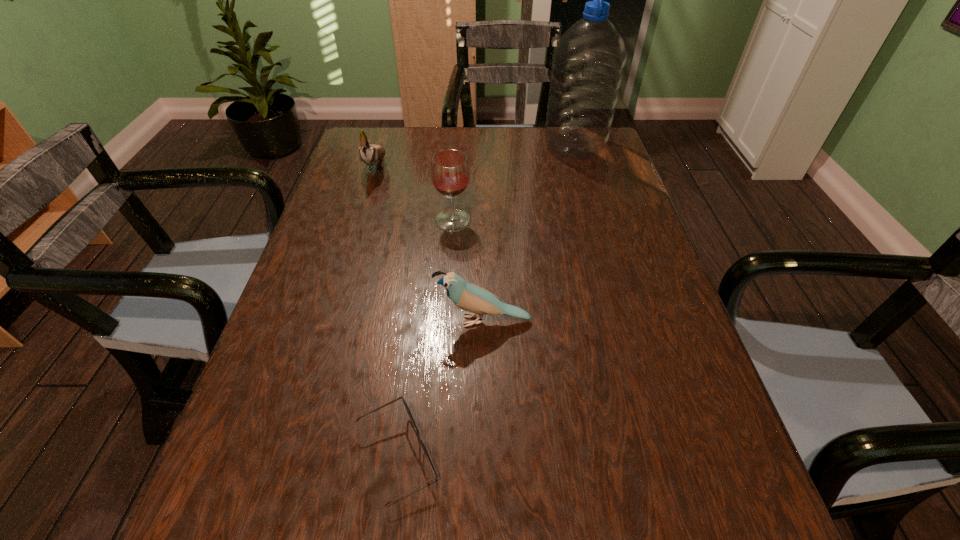
Find the location of a particular element. object situated at the far left corner is located at coordinates (370, 154).

Where is `object present at the far right corner`? This screenshot has width=960, height=540. object present at the far right corner is located at coordinates (588, 63).

Locate an element on the screen. This screenshot has height=540, width=960. vacant space at the far edge of the desktop is located at coordinates [457, 136].

Find the location of a particular element. The width and height of the screenshot is (960, 540). vacant region at the left edge is located at coordinates (384, 180).

This screenshot has width=960, height=540. In the image, there is a desktop. Identify the location of vacant region at the right edge. (627, 338).

Image resolution: width=960 pixels, height=540 pixels. Identify the location of free space at the far left corner of the desktop. (363, 130).

Identify the location of free space at the near right corner. (723, 530).

Locate an element on the screen. The image size is (960, 540). free area in between the water jug and the left bird is located at coordinates (475, 156).

This screenshot has width=960, height=540. Find the location of `vacant area that lies between the second nearest object and the wineglass`. vacant area that lies between the second nearest object and the wineglass is located at coordinates (468, 271).

Identify the location of vacant area that lies between the shortest object and the third nearest object. This screenshot has width=960, height=540. (425, 338).